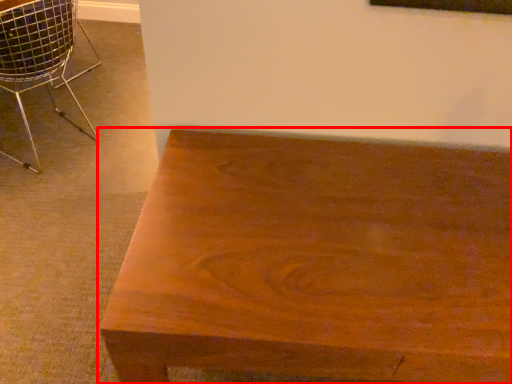
Question: Observing the image, what is the correct spatial positioning of table (annotated by the red box) in reference to chair?

Choices:
 (A) right
 (B) left

Answer: (A)